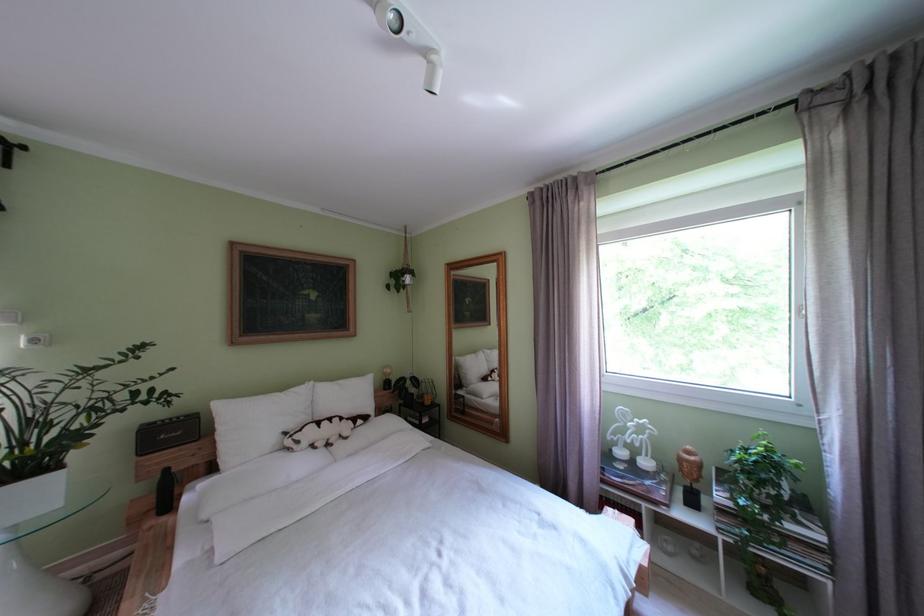
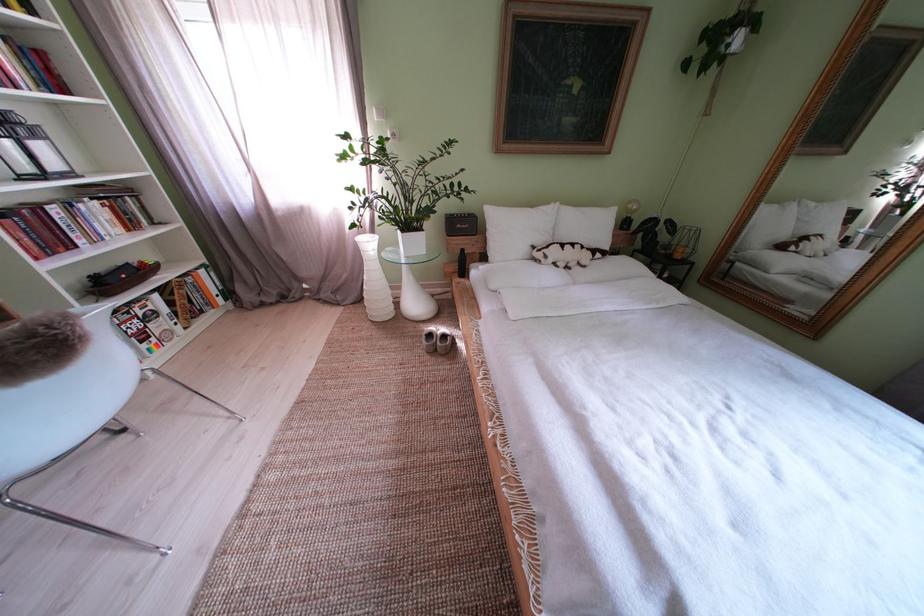
Based on the photo, first-person continuous shooting, in which direction is the camera rotating?

The rotation direction of the camera is left-down.